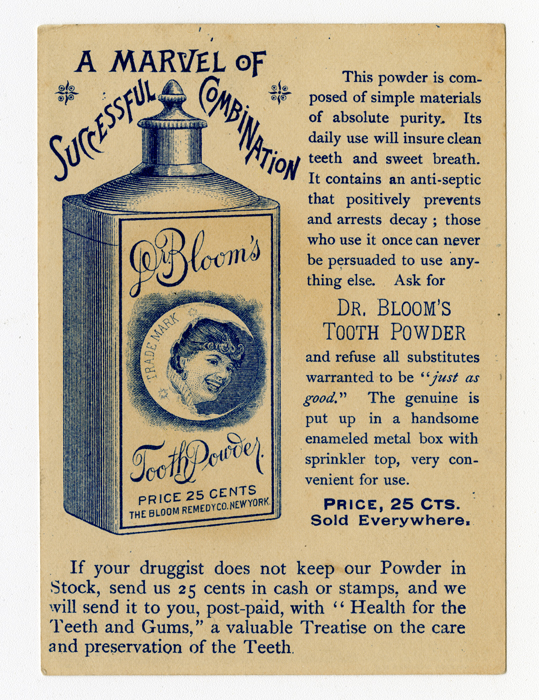
The image size is (539, 700). In order to click on bottle in this screenshot , I will do `click(106, 354)`.